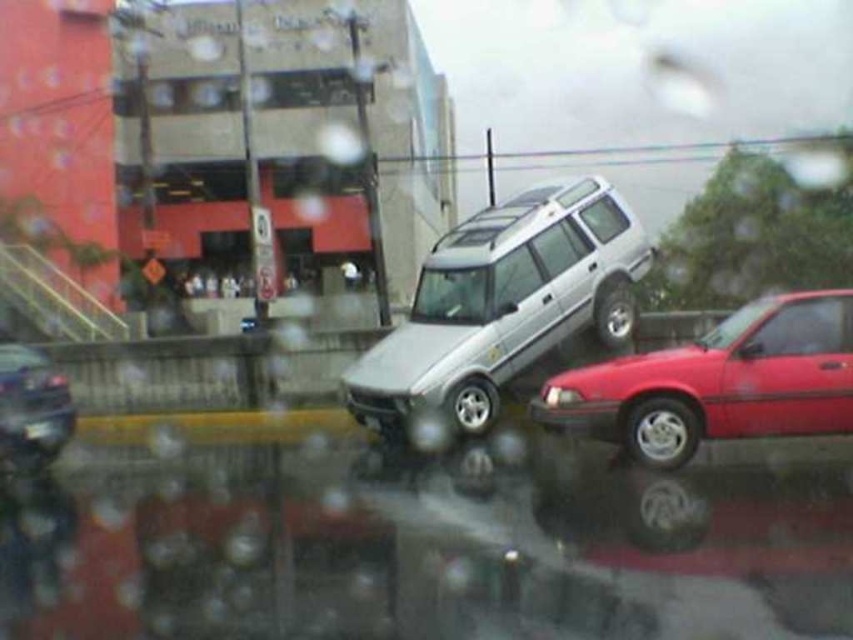
Question: Which object is farther from the camera taking this photo?

Choices:
 (A) shiny red sedan at right
 (B) black plastic license plate at lower left

Answer: (B)

Question: Which object appears closest to the camera in this image?

Choices:
 (A) black plastic license plate at lower left
 (B) shiny black sedan at lower left

Answer: (B)

Question: Which point is farther to the camera?

Choices:
 (A) black plastic license plate at lower left
 (B) shiny black sedan at lower left
 (C) shiny red sedan at right
 (D) silver metallic suv at center

Answer: (D)

Question: Does shiny red sedan at right appear over shiny black sedan at lower left?

Choices:
 (A) yes
 (B) no

Answer: (A)

Question: Can you confirm if shiny black sedan at lower left is positioned above black plastic license plate at lower left?

Choices:
 (A) yes
 (B) no

Answer: (A)

Question: Is silver metallic suv at center behind black plastic license plate at lower left?

Choices:
 (A) no
 (B) yes

Answer: (B)